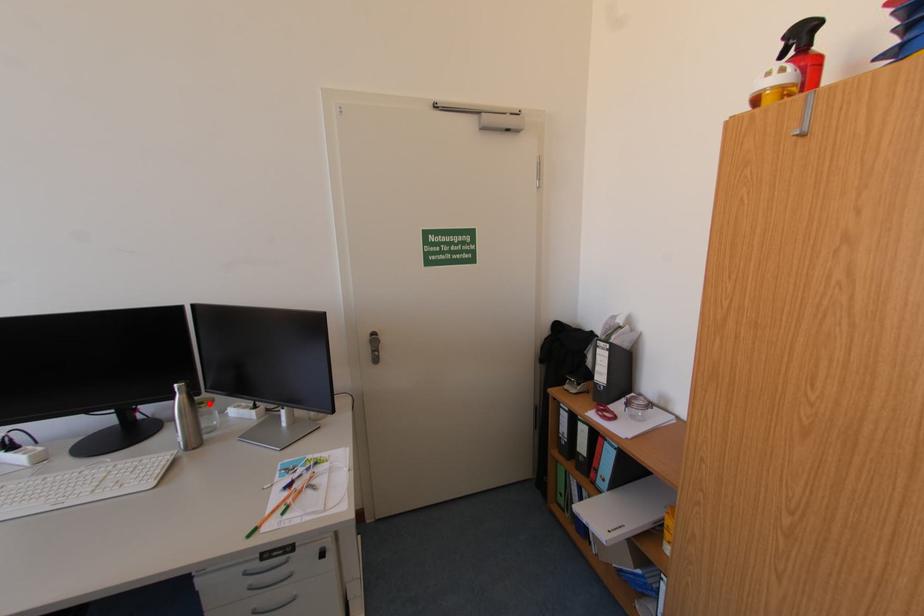
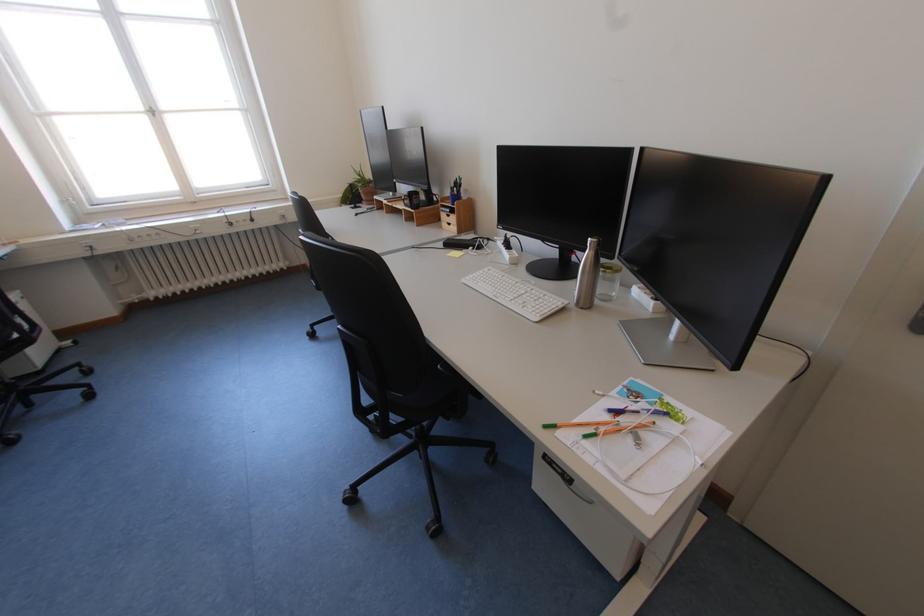
Find the pixel in the second image that matches the highlighted location in the first image.

(617, 270)